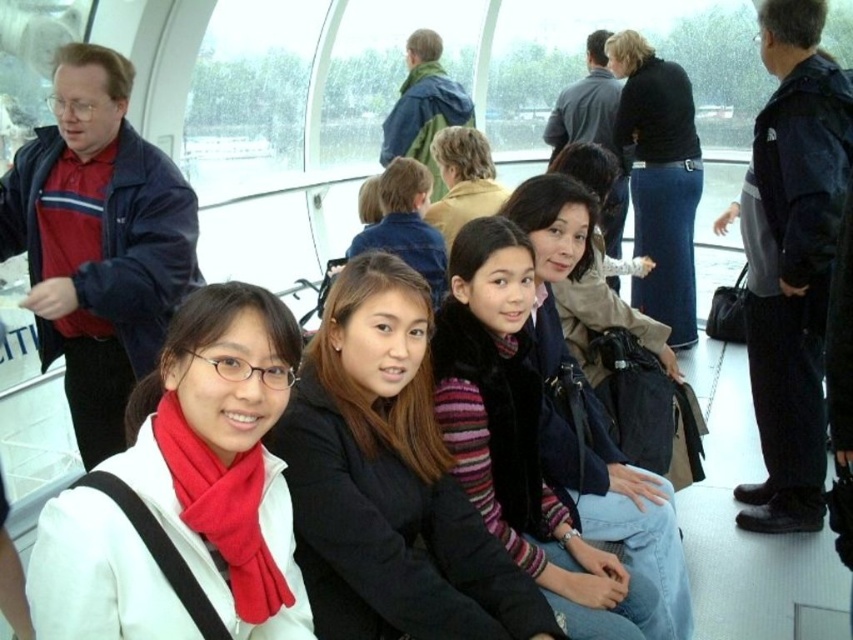
You are a photographer trying to capture a candid shot of the group at the center. You notice two items of clothing, the black fuzzy vest at center and the black leather jacket at center. Which one is positioned lower on the person wearing them?

The black fuzzy vest at center is below the black leather jacket at center, so the black fuzzy vest at center is positioned lower on the person wearing them.

You are standing at point (456, 180) and want to walk to point (648, 76). Is the destination point behind you or in front of you?

The destination point (648, 76) is behind point (456, 180), so it is behind you.

You are a photographer trying to capture a candid shot of the black fuzzy vest at center and the black leather jacket at center. Which one will appear larger in your photo?

The black fuzzy vest at center will appear larger in the photo because it is closer to the viewer than the black leather jacket at center.